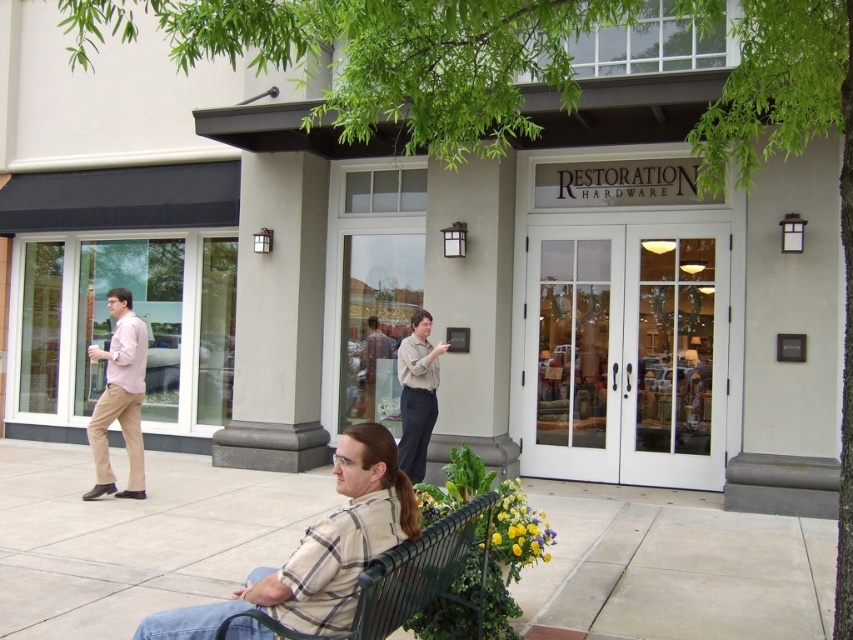
You are standing at the entrance of Restoration Hardware and see a green metal bench at lower center and a light brown shirt at center. Which object is closer to the entrance?

The green metal bench at lower center is closer to the entrance because it is positioned below the light brown shirt at center, indicating it is lower in the frame and thus nearer to the viewer standing at the entrance.

You are a photographer taking a picture of the two people at the center of the scene. The plaid shirt at center and the light brown shirt at center are both in the frame. Which of their shirts is shorter in the photo?

The plaid shirt at center is shorter than the light brown shirt at center in the photo.

You are a photographer standing at the entrance of Restoration Hardware. You need to capture a photo that includes both the plaid shirt at center and the green metal bench at lower center. Considering their sizes, which object will appear wider in the photo?

The plaid shirt at center will appear wider in the photo because its width is larger than the green metal bench at lower center.